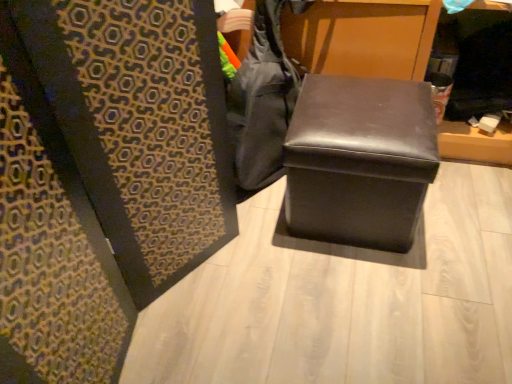
Find the location of a particular element. The image size is (512, 384). blank space situated above matte black ottoman at center (from a real-world perspective) is located at coordinates (355, 114).